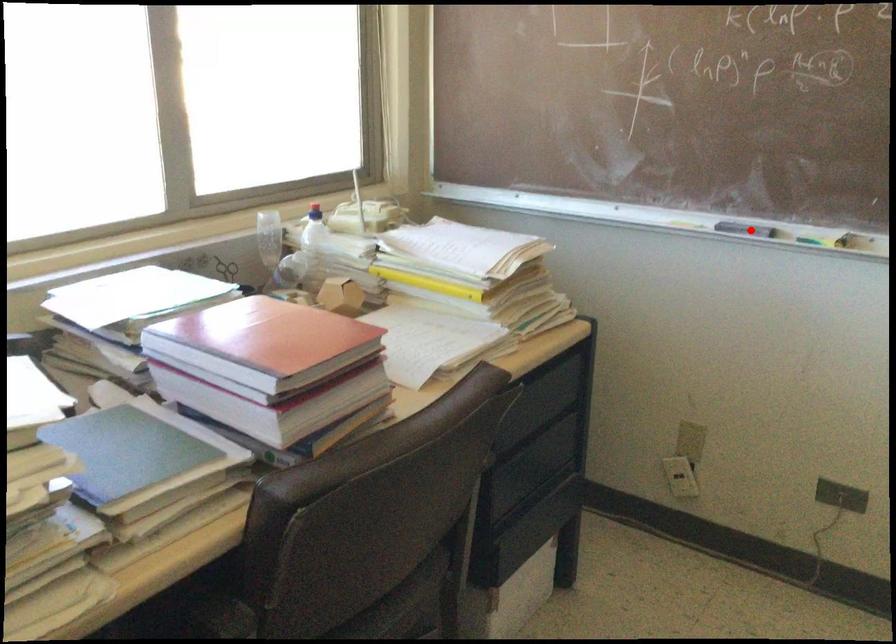
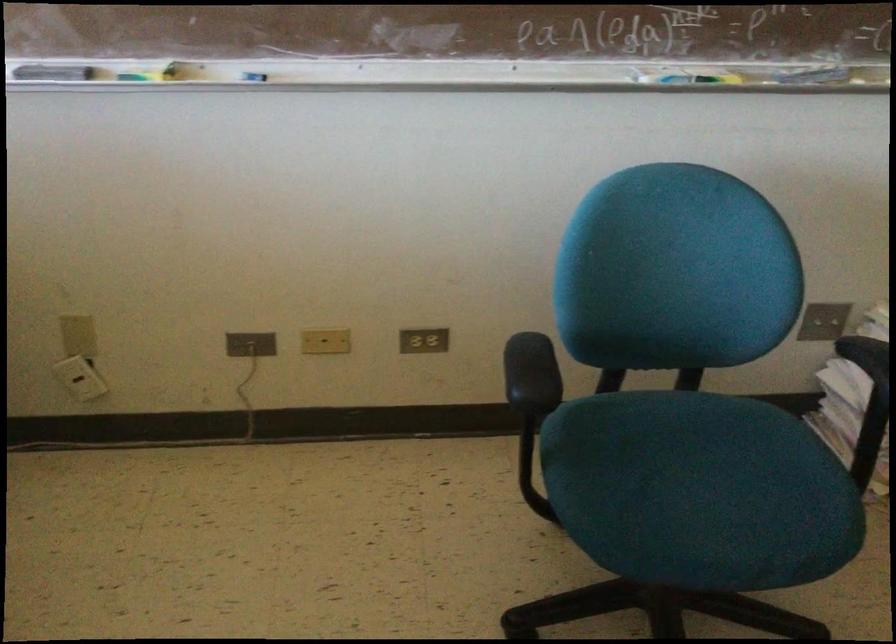
Question: I am providing you with two images of the same scene from different viewpoints. Image1 has a red point marked. In image2, the corresponding 3D location appears at what relative position? Reply with the corresponding letter.

Choices:
 (A) Closer
 (B) Farther

Answer: (A)